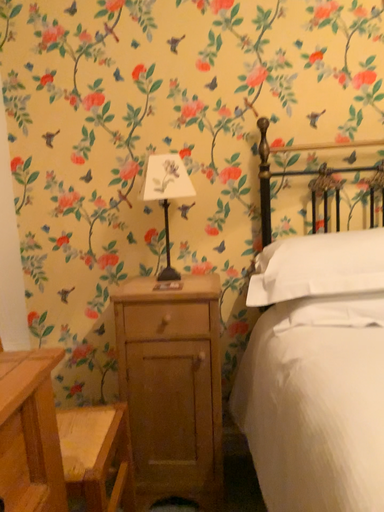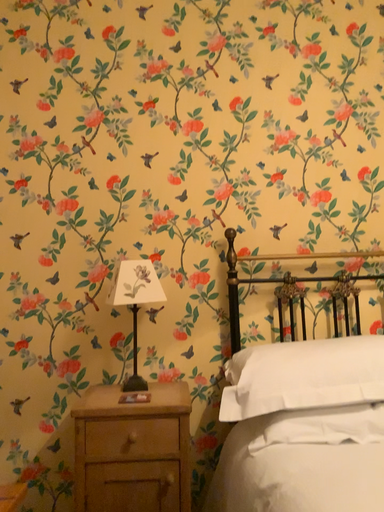
Question: Which way did the camera rotate in the video?

Choices:
 (A) rotated downward
 (B) rotated upward

Answer: (B)